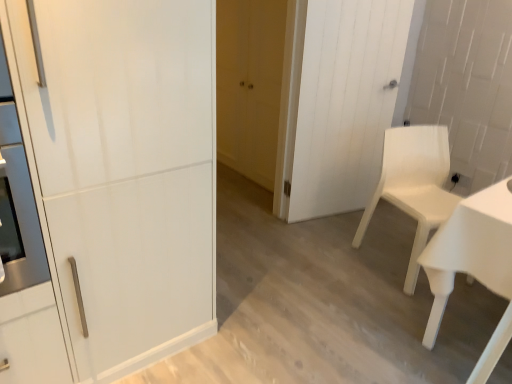
Where is `free space underneath white plastic chair at right (from a real-world perspective)`? This screenshot has height=384, width=512. free space underneath white plastic chair at right (from a real-world perspective) is located at coordinates tap(391, 256).